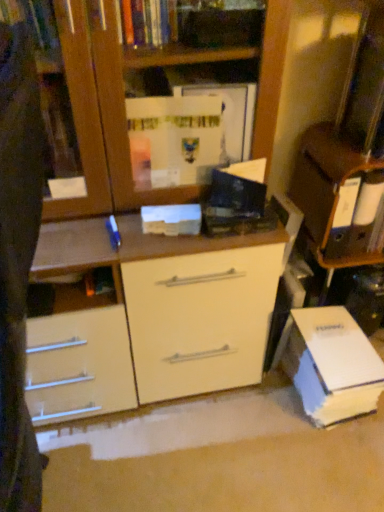
At what (x,y) coordinates should I click in order to perform the action: click on free spot to the left of white cardboard book at lower right, arranged as the 2th paperback book when viewed from the front. Please return your answer as a coordinate pair (x, y). This screenshot has height=512, width=384. Looking at the image, I should click on (254, 415).